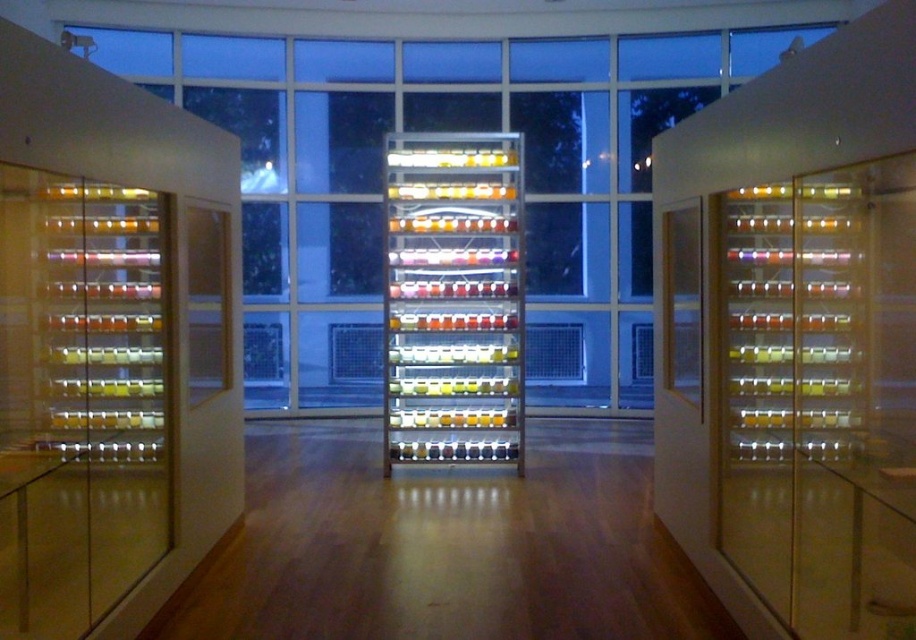
You are an artist planning to place a new sculpture on the translucent glass shelves at left and the translucent plastic jars at center. Which surface should you choose if you want the sculpture to be at a lower height?

The translucent glass shelves at left are located below the translucent plastic jars at center, so placing the sculpture there would position it at a lower height.

You are an interior designer assessing the space for a new piece of furniture. You notice the clear glass cabinet at right and the translucent glass shelves at left. Which one has a larger footprint in the room?

The clear glass cabinet at right has a larger footprint than the translucent glass shelves at left because it is bigger.